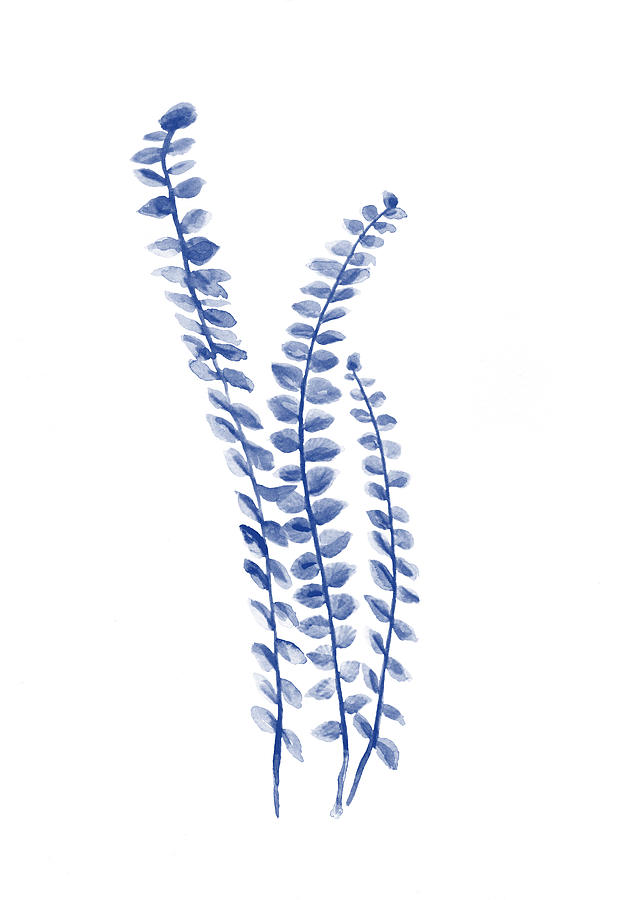
Locate an element on the screen. The image size is (621, 900). white background above painting is located at coordinates (286, 148).